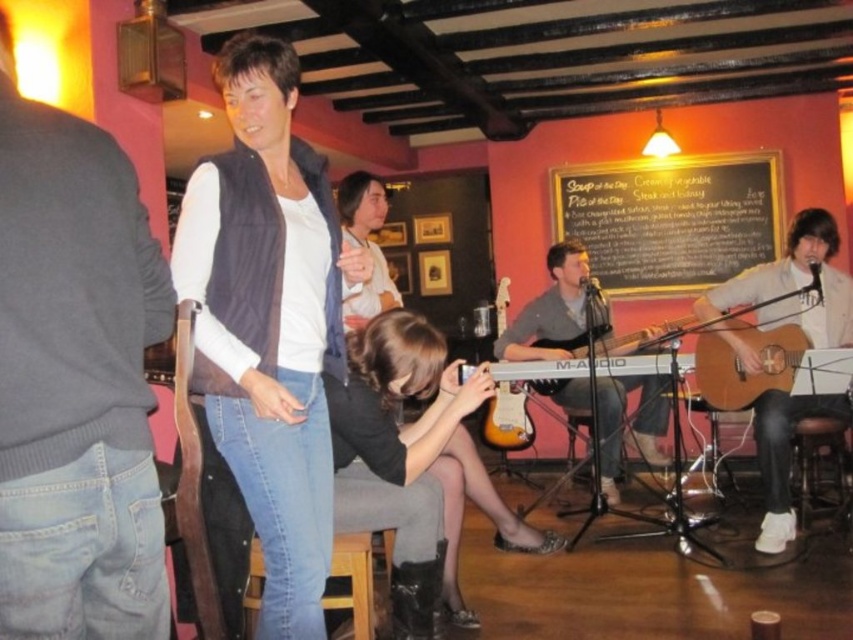
You are a photographer at the venue and want to take a photo of both the matte blue vest at center and the wooden bar stool at lower right. However, you can only focus on one object at a time. Which object should you focus on first to ensure the other remains in the background?

You should focus on the matte blue vest at center first since it is closer to the viewer than the wooden bar stool at lower right, allowing the stool to stay in the background.

You are a photographer at the event and want to take a picture of the acoustic wood guitar at center. Where should you position yourself to capture it in the frame?

The acoustic wood guitar at center is located at point (672, 330), so you should position yourself directly in front of that coordinate to capture it in the frame.

You are a photographer at the venue and want to capture both the black leather boots at lower center and the wooden acoustic guitar at center in a single shot. Based on their positions, which object should you focus on first to ensure both are in frame?

Since the black leather boots at lower center is positioned on the left side of wooden acoustic guitar at center, you should focus on the wooden acoustic guitar at center first to ensure both objects are captured in the frame.